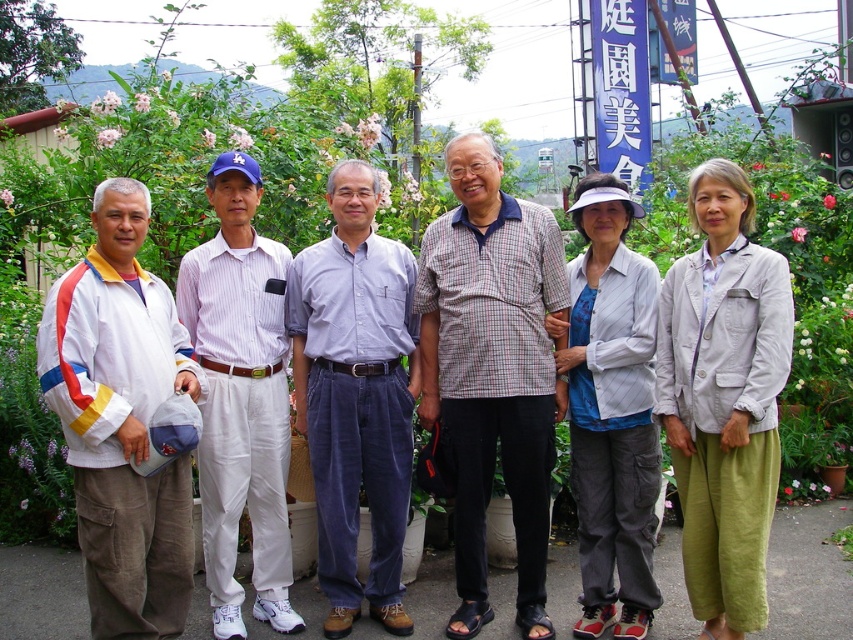
You are a photographer trying to capture a group photo of the plaid cotton shirt at center and the light blue corduroy shirt at center. The camera you are using has a minimum focus distance of 24 inches. Will you be able to focus on both subjects at the same time?

The plaid cotton shirt at center and light blue corduroy shirt at center are 23.61 inches apart from each other, which is less than the camera minimum focus distance of 24 inches. Therefore, the camera cannot focus on both subjects at the same time.

Based on the photo, you are a photographer trying to adjust the positions of the people in the group photo. You need to ensure that the white cotton jacket at left is not overlapping with the white striped shirt at center. Based on their current positions, can you confirm if they are already spaced apart appropriately?

The white cotton jacket at left is positioned on the left side of white striped shirt at center, so they are already spaced apart and not overlapping.

You are a photographer trying to capture a clear photo of both the plaid cotton shirt at center and the light blue corduroy shirt at center. Which one should you focus on first to ensure both are in focus?

You should focus on the plaid cotton shirt at center first because it is closer to the viewer than the light blue corduroy shirt at center, so adjusting focus from near to far will help both be in focus.